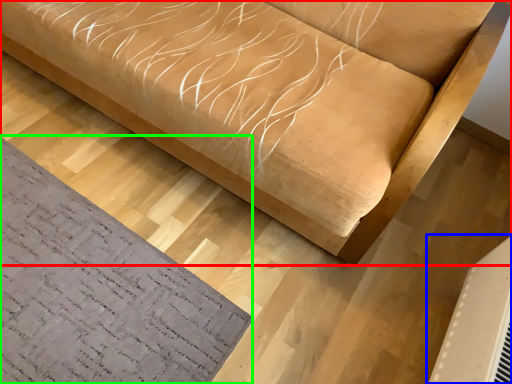
Question: Based on their relative distances, which object is nearer to furniture (highlighted by a red box)? Choose from air conditioning (highlighted by a blue box) and mat (highlighted by a green box).

Choices:
 (A) air conditioning
 (B) mat

Answer: (B)